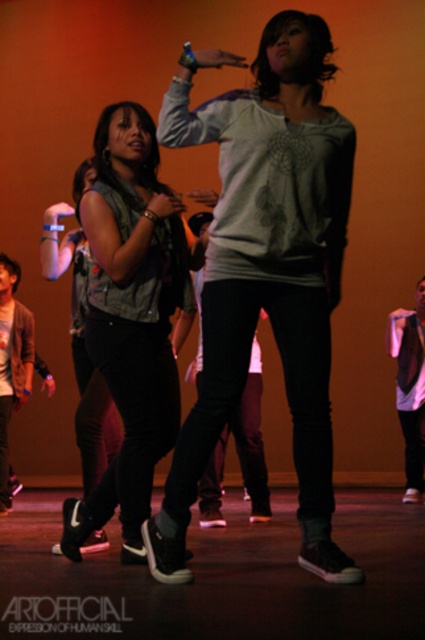
In the scene shown: You are designing a new dance costume and need to choose between the matte gray sweatshirt at center and the denim vest at center. Which one offers more space for movement due to its size?

The matte gray sweatshirt at center is bigger than the denim vest at center, so it offers more space for movement.

You are a costume designer reviewing the dance performance. You notice two performers wearing the denim vest at center and white matte shirt at center. Which clothing item is layered on top?

The denim vest at center is positioned over the white matte shirt at center, so the denim vest at center is layered on top.